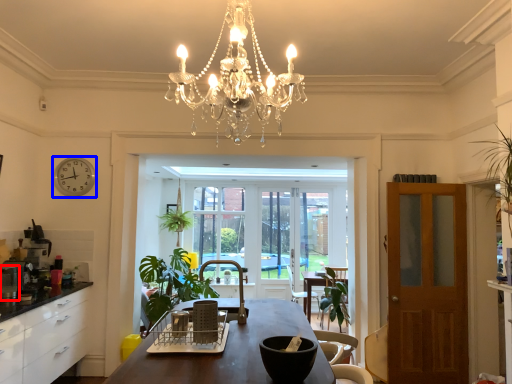
Question: Which of the following is the farthest to the observer, appliance (highlighted by a red box) or clock (highlighted by a blue box)?

Choices:
 (A) appliance
 (B) clock

Answer: (B)